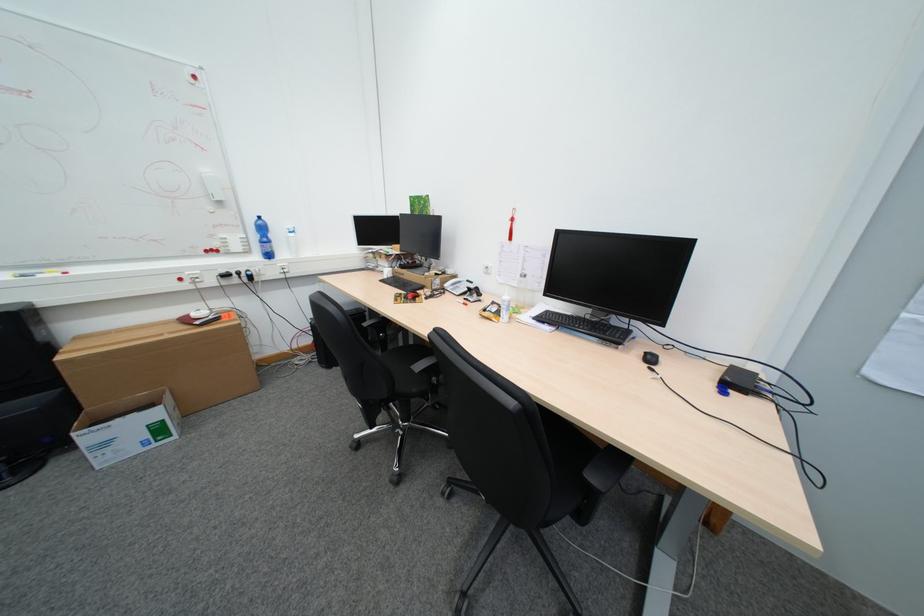
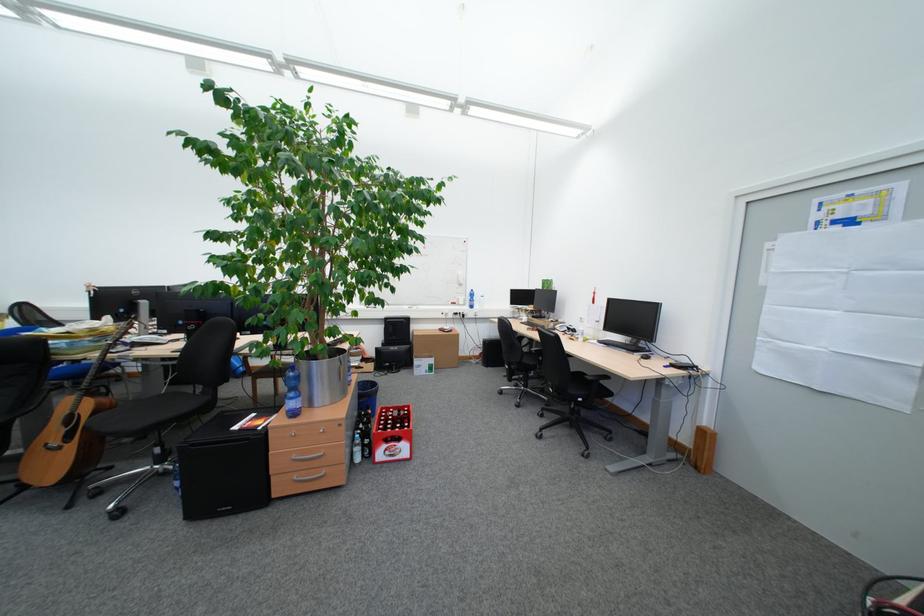
Locate, in the second image, the point that corresponds to the point at 167,415 in the first image.

(444, 362)